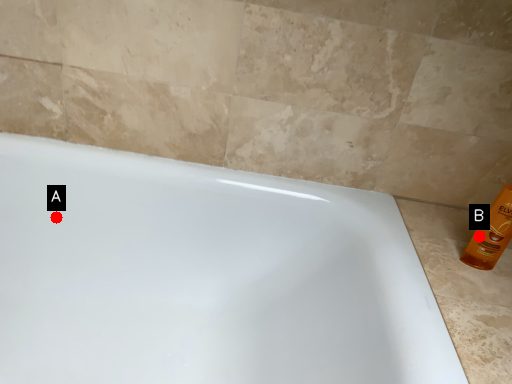
Question: Two points are circled on the image, labeled by A and B beside each circle. Which point is closer to the camera taking this photo?

Choices:
 (A) A is closer
 (B) B is closer

Answer: (B)